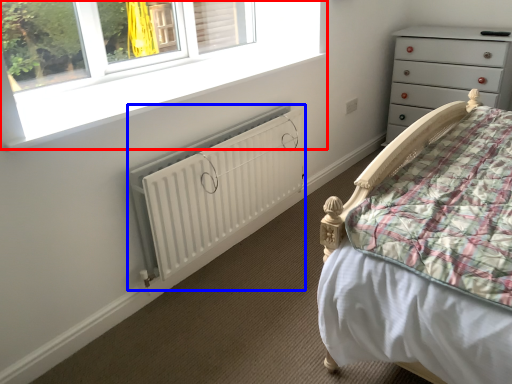
Question: Which object is closer to the camera taking this photo, window (highlighted by a red box) or radiator (highlighted by a blue box)?

Choices:
 (A) window
 (B) radiator

Answer: (A)